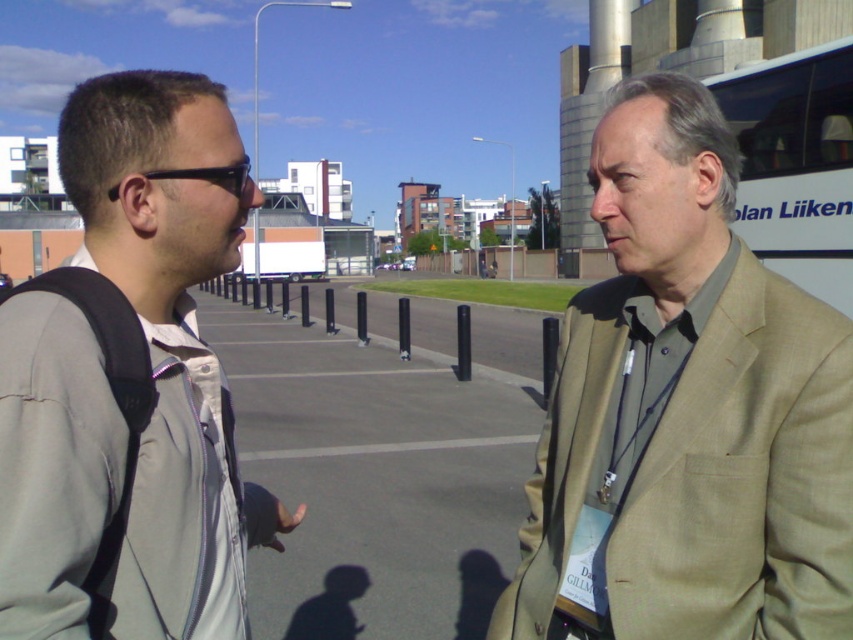
You are a photographer standing near the gray fabric jacket at left. You want to take a photo of the camera that is 3.87 feet away. Can you reach it without moving from your current position?

The camera is 3.87 feet away from the gray fabric jacket at left. Since the average human arm length is about 2.5 feet, you cannot reach the camera without moving from your current position.

You are standing at the origin point of the image coordinate system. The person wearing a tan fabric suit is at point [686,413]. If you want to walk towards the person wearing a tan fabric suit, which direction should you move? Please answer with either north, south, east, or west.

The tan fabric suit at right is located at point [686,413]. Since the coordinate system has the origin at the bottom left corner, moving towards higher x values means east and higher y values mean north. To reach the point, you should move northeast.